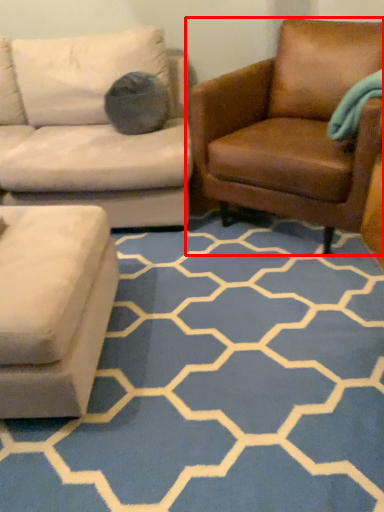
Question: From the image's perspective, what is the correct spatial relationship of chair (annotated by the red box) in relation to pattern?

Choices:
 (A) above
 (B) below

Answer: (A)